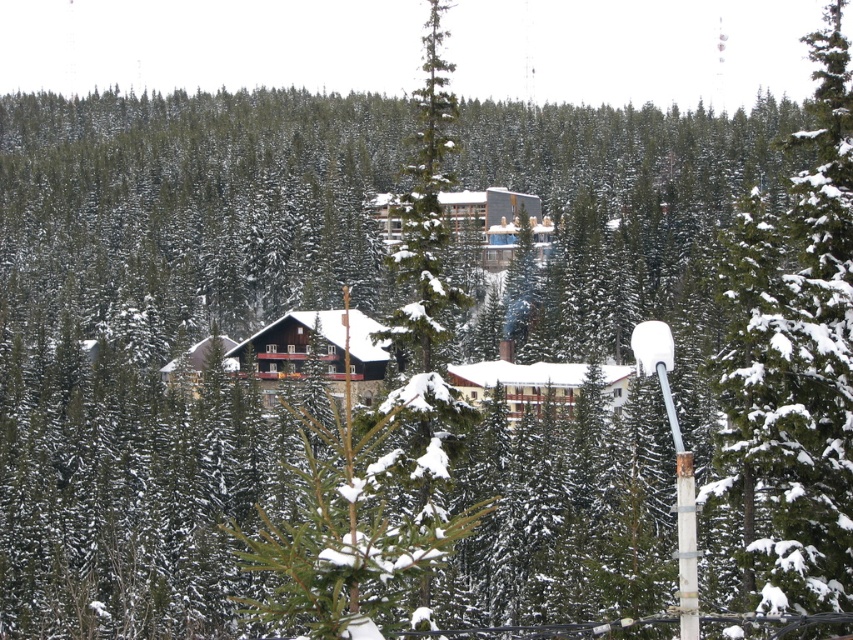
Question: Which object appears farthest from the camera in this image?

Choices:
 (A) green textured pine tree at center
 (B) white wood cabin at center
 (C) dark brown wooden cabin at center

Answer: (B)

Question: Can you confirm if green textured pine tree at center is positioned to the right of white wood cabin at center?

Choices:
 (A) no
 (B) yes

Answer: (B)

Question: Which object appears farthest from the camera in this image?

Choices:
 (A) green textured pine tree at center
 (B) white wood cabin at center

Answer: (B)

Question: Among these points, which one is nearest to the camera?

Choices:
 (A) pyautogui.click(x=849, y=449)
 (B) pyautogui.click(x=358, y=320)
 (C) pyautogui.click(x=531, y=387)

Answer: (A)

Question: Does green textured pine tree at center have a larger size compared to white wood cabin at center?

Choices:
 (A) no
 (B) yes

Answer: (B)

Question: Can you confirm if green textured pine tree at center is positioned below white wood cabin at center?

Choices:
 (A) no
 (B) yes

Answer: (A)